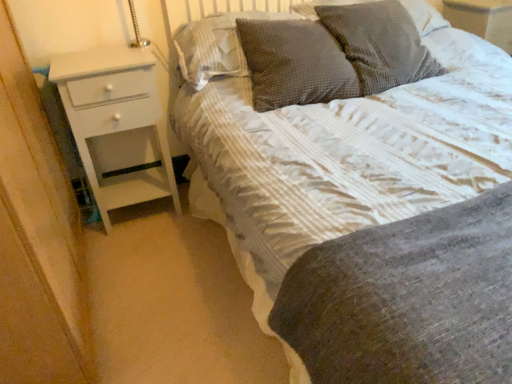
Question: Considering the positions of woven fabric pillow at upper center, the 4th pillow in the left-to-right sequence, and woven fabric pillow at upper center, positioned as the 3th pillow in left-to-right order, in the image, is woven fabric pillow at upper center, the 4th pillow in the left-to-right sequence, wider or thinner than woven fabric pillow at upper center, positioned as the 3th pillow in left-to-right order,?

Choices:
 (A) thin
 (B) wide

Answer: (B)

Question: Is woven fabric pillow at upper center, marked as the first pillow in a right-to-left arrangement, spatially inside woven fabric pillow at upper center, positioned as the 3th pillow in left-to-right order, or outside of it?

Choices:
 (A) inside
 (B) outside

Answer: (B)

Question: Considering the real-world distances, which object is farthest from the dark grey textured pillow at upper center, placed as the second pillow when sorted from left to right?

Choices:
 (A) woven fabric pillow at upper center, marked as the first pillow in a right-to-left arrangement
 (B) white glossy chest of drawers at left
 (C) white textured bed at center
 (D) waffle-textured gray pillow at upper center, marked as the 4th pillow in a right-to-left arrangement
 (E) woven fabric pillow at upper center, which is the second pillow from right to left

Answer: (A)

Question: Considering the real-world distances, which object is farthest from the woven fabric pillow at upper center, which is the second pillow from right to left?

Choices:
 (A) woven fabric pillow at upper center, marked as the first pillow in a right-to-left arrangement
 (B) white glossy chest of drawers at left
 (C) white textured bed at center
 (D) dark grey textured pillow at upper center, positioned as the third pillow in right-to-left order
 (E) waffle-textured gray pillow at upper center, marked as the 4th pillow in a right-to-left arrangement

Answer: (B)